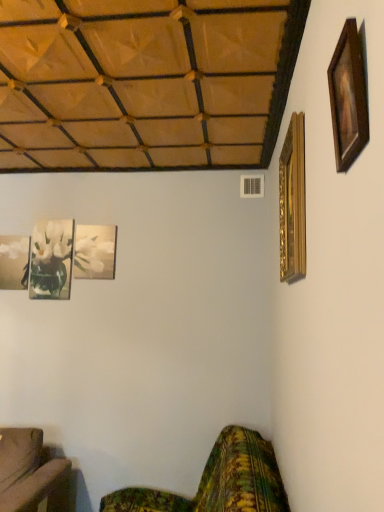
You are a GUI agent. You are given a task and a screenshot of the screen. Output one action in this format:
    pyautogui.click(x=<x>, y=<y>)
    Task: Click on the matte glass vase at left, the fifth picture frame from the front
    The image size is (384, 512).
    Given the screenshot: What is the action you would take?
    pyautogui.click(x=14, y=262)

What do you see at coordinates (95, 252) in the screenshot?
I see `white glossy picture frame at upper left, the third picture frame when ordered from left to right` at bounding box center [95, 252].

This screenshot has height=512, width=384. What do you see at coordinates (51, 260) in the screenshot?
I see `matte glass picture frame at lower left, the second picture frame viewed from the left` at bounding box center [51, 260].

Identify the location of matte glass vase at left, which appears as the 1th picture frame when viewed from the left. (14, 262).

From the image's perspective, is white glossy picture frame at upper left, the 3th picture frame when ordered from back to front, positioned above or below matte glass vase at left, which appears as the 1th picture frame when viewed from the left?

white glossy picture frame at upper left, the 3th picture frame when ordered from back to front, is situated higher than matte glass vase at left, which appears as the 1th picture frame when viewed from the left, in the image.

Which point is more distant from viewer, (x=78, y=246) or (x=15, y=289)?

Positioned behind is point (x=15, y=289).

At what (x,y) coordinates should I click in order to perform the action: click on picture frame that is the 2nd object located below the white glossy picture frame at upper left, the third picture frame when ordered from left to right (from the image's perspective). Please return your answer as a coordinate pair (x, y). Looking at the image, I should click on (14, 262).

From the image's perspective, is green floral fabric couch at lower right above or below matte glass picture frame at lower left, arranged as the 4th picture frame when viewed from the front?

From the image's perspective, green floral fabric couch at lower right appears below matte glass picture frame at lower left, arranged as the 4th picture frame when viewed from the front.

From a real-world perspective, is green floral fabric couch at lower right physically located above or below matte glass picture frame at lower left, arranged as the 4th picture frame when viewed from the front?

green floral fabric couch at lower right is situated lower than matte glass picture frame at lower left, arranged as the 4th picture frame when viewed from the front, in the real world.

Is green floral fabric couch at lower right oriented towards matte glass picture frame at lower left, arranged as the 4th picture frame when viewed from the front?

No.

From the image's perspective, starting from the green floral fabric couch at lower right, which picture frame is the 2nd one above? Please provide its 2D coordinates.

[(51, 260)]

Can you confirm if matte glass picture frame at lower left, which ranks as the 4th picture frame in right-to-left order, is shorter than matte glass vase at left, which appears as the 1th picture frame when viewed from the left?

Incorrect, the height of matte glass picture frame at lower left, which ranks as the 4th picture frame in right-to-left order, does not fall short of that of matte glass vase at left, which appears as the 1th picture frame when viewed from the left.

Considering the sizes of objects matte glass picture frame at lower left, the 2th picture frame from the back, and matte glass vase at left, which appears as the first picture frame when viewed from the back, in the image provided, who is bigger, matte glass picture frame at lower left, the 2th picture frame from the back, or matte glass vase at left, which appears as the first picture frame when viewed from the back,?

With larger size is matte glass picture frame at lower left, the 2th picture frame from the back.

From the image's perspective, count 3rd picture frames upward from the green floral fabric couch at lower right and point to it. Please provide its 2D coordinates.

[(95, 252)]

Based on their sizes in the image, would you say green floral fabric couch at lower right is bigger or smaller than white glossy picture frame at upper left, the 3th picture frame when ordered from back to front?

Clearly, green floral fabric couch at lower right is larger in size than white glossy picture frame at upper left, the 3th picture frame when ordered from back to front.

From the image's perspective, between green floral fabric couch at lower right and white glossy picture frame at upper left, placed as the third picture frame when sorted from right to left, which one is located above?

white glossy picture frame at upper left, placed as the third picture frame when sorted from right to left, from the image's perspective.

From a real-world perspective, between green floral fabric couch at lower right and white glossy picture frame at upper left, the 3th picture frame when ordered from back to front, who is vertically higher?

In real-world perspective, white glossy picture frame at upper left, the 3th picture frame when ordered from back to front, is above.

From a real-world perspective, is white glossy picture frame at upper left, the 3th picture frame when ordered from back to front, physically located above or below gold ornate picture frame at upper right, which is the fourth picture frame from back to front?

white glossy picture frame at upper left, the 3th picture frame when ordered from back to front, is situated lower than gold ornate picture frame at upper right, which is the fourth picture frame from back to front, in the real world.

Does white glossy picture frame at upper left, the 3th picture frame positioned from the front, contain gold ornate picture frame at upper right, the second picture frame positioned from the front?

Actually, gold ornate picture frame at upper right, the second picture frame positioned from the front, is outside white glossy picture frame at upper left, the 3th picture frame positioned from the front.

Which object is positioned more to the right, white glossy picture frame at upper left, the 3th picture frame when ordered from back to front, or gold ornate picture frame at upper right, acting as the 5th picture frame starting from the left?

gold ornate picture frame at upper right, acting as the 5th picture frame starting from the left, is more to the right.

Is white glossy picture frame at upper left, the 3th picture frame positioned from the front, directly adjacent to gold ornate picture frame at upper right, which is the fourth picture frame from back to front?

No, white glossy picture frame at upper left, the 3th picture frame positioned from the front, is not next to gold ornate picture frame at upper right, which is the fourth picture frame from back to front.

How different are the orientations of white glossy picture frame at upper left, the 3th picture frame positioned from the front, and matte glass picture frame at lower left, which ranks as the 4th picture frame in right-to-left order, in degrees?

white glossy picture frame at upper left, the 3th picture frame positioned from the front, and matte glass picture frame at lower left, which ranks as the 4th picture frame in right-to-left order, are facing 0.756 degrees away from each other.

From a real-world perspective, which is physically above, white glossy picture frame at upper left, the 3th picture frame when ordered from back to front, or matte glass picture frame at lower left, the 2th picture frame from the back?

white glossy picture frame at upper left, the 3th picture frame when ordered from back to front, is physically above.

From the image's perspective, between white glossy picture frame at upper left, the third picture frame when ordered from left to right, and matte glass picture frame at lower left, which ranks as the 4th picture frame in right-to-left order, which one is located above?

white glossy picture frame at upper left, the third picture frame when ordered from left to right, appears higher in the image.

Is matte glass picture frame at lower left, which ranks as the 4th picture frame in right-to-left order, at the back of white glossy picture frame at upper left, the 3th picture frame when ordered from back to front?

No, white glossy picture frame at upper left, the 3th picture frame when ordered from back to front, is not facing the opposite direction of matte glass picture frame at lower left, which ranks as the 4th picture frame in right-to-left order.

The image size is (384, 512). Identify the location of studio couch lying behind the wooden picture frame at upper right, which is counted as the fourth picture frame, starting from the left. (218, 481).

How different are the orientations of wooden picture frame at upper right, arranged as the first picture frame when viewed from the front, and green floral fabric couch at lower right in degrees?

→ The angle between the facing direction of wooden picture frame at upper right, arranged as the first picture frame when viewed from the front, and the facing direction of green floral fabric couch at lower right is 0.384 degrees.

Measure the distance from wooden picture frame at upper right, which is counted as the fourth picture frame, starting from the left, to green floral fabric couch at lower right.

They are 5.23 feet apart.

Considering the sizes of wooden picture frame at upper right, the fifth picture frame positioned from the back, and green floral fabric couch at lower right in the image, is wooden picture frame at upper right, the fifth picture frame positioned from the back, taller or shorter than green floral fabric couch at lower right?

Clearly, wooden picture frame at upper right, the fifth picture frame positioned from the back, is shorter compared to green floral fabric couch at lower right.

I want to click on picture frame that is the 2nd one when counting downward from the white glossy picture frame at upper left, the 3th picture frame when ordered from back to front (from the image's perspective), so click(14, 262).

Find the location of `studio couch in front of the matte glass picture frame at lower left, arranged as the 4th picture frame when viewed from the front`. studio couch in front of the matte glass picture frame at lower left, arranged as the 4th picture frame when viewed from the front is located at coordinates (218, 481).

Looking at the image, which one is located closer to white glossy picture frame at upper left, the 3th picture frame when ordered from back to front, gold ornate picture frame at upper right, the second picture frame positioned from the front, or wooden picture frame at upper right, arranged as the first picture frame when viewed from the front?

gold ornate picture frame at upper right, the second picture frame positioned from the front.

Which object lies nearer to the anchor point white glossy picture frame at upper left, the 3th picture frame when ordered from back to front, gold ornate picture frame at upper right, the first picture frame positioned from the right, or matte glass picture frame at lower left, the second picture frame viewed from the left?

matte glass picture frame at lower left, the second picture frame viewed from the left.

Considering their positions, is matte glass vase at left, which appears as the 1th picture frame when viewed from the left, positioned closer to white glossy picture frame at upper left, the third picture frame when ordered from left to right, than green floral fabric couch at lower right?

The object closer to white glossy picture frame at upper left, the third picture frame when ordered from left to right, is matte glass vase at left, which appears as the 1th picture frame when viewed from the left.

Which object lies further to the anchor point matte glass picture frame at lower left, arranged as the 4th picture frame when viewed from the front, matte glass vase at left, which appears as the 1th picture frame when viewed from the left, or wooden picture frame at upper right, the fifth picture frame positioned from the back?

The object further to matte glass picture frame at lower left, arranged as the 4th picture frame when viewed from the front, is wooden picture frame at upper right, the fifth picture frame positioned from the back.

From the image, which object appears to be farther from matte glass picture frame at lower left, which ranks as the 4th picture frame in right-to-left order, gold ornate picture frame at upper right, the second picture frame positioned from the front, or white glossy picture frame at upper left, placed as the third picture frame when sorted from right to left?

The object further to matte glass picture frame at lower left, which ranks as the 4th picture frame in right-to-left order, is gold ornate picture frame at upper right, the second picture frame positioned from the front.

Considering their positions, is wooden picture frame at upper right, the second picture frame when ordered from right to left, positioned closer to matte glass vase at left, the fifth picture frame from the front, than green floral fabric couch at lower right?

Based on the image, green floral fabric couch at lower right appears to be nearer to matte glass vase at left, the fifth picture frame from the front.

Looking at this image, which object lies further to the anchor point wooden picture frame at upper right, which is counted as the fourth picture frame, starting from the left, gold ornate picture frame at upper right, acting as the 5th picture frame starting from the left, or matte glass picture frame at lower left, the second picture frame viewed from the left?

matte glass picture frame at lower left, the second picture frame viewed from the left, is further to wooden picture frame at upper right, which is counted as the fourth picture frame, starting from the left.

Based on their spatial positions, is matte glass vase at left, the fifth picture frame from the front, or green floral fabric couch at lower right closer to wooden picture frame at upper right, which is counted as the fourth picture frame, starting from the left?

green floral fabric couch at lower right is positioned closer to the anchor wooden picture frame at upper right, which is counted as the fourth picture frame, starting from the left.

The width and height of the screenshot is (384, 512). Find the location of `studio couch between wooden picture frame at upper right, the second picture frame when ordered from right to left, and matte glass vase at left, the 5th picture frame from the right, in the front-back direction`. studio couch between wooden picture frame at upper right, the second picture frame when ordered from right to left, and matte glass vase at left, the 5th picture frame from the right, in the front-back direction is located at coordinates (218, 481).

What are the coordinates of `picture frame between matte glass vase at left, the 5th picture frame from the right, and white glossy picture frame at upper left, placed as the third picture frame when sorted from right to left` in the screenshot? It's located at (51, 260).

The image size is (384, 512). Identify the location of picture frame positioned between wooden picture frame at upper right, the second picture frame when ordered from right to left, and white glossy picture frame at upper left, the 3th picture frame when ordered from back to front, from near to far. (292, 202).

Locate an element on the screen. The width and height of the screenshot is (384, 512). picture frame between gold ornate picture frame at upper right, the first picture frame positioned from the right, and matte glass picture frame at lower left, the second picture frame viewed from the left, along the z-axis is located at coordinates (95, 252).